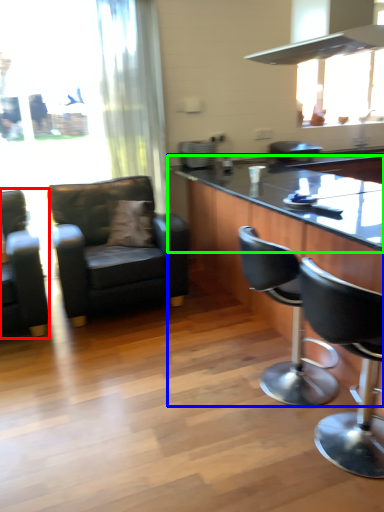
Question: Which is nearer to the chair (highlighted by a red box)? table (highlighted by a blue box) or countertop (highlighted by a green box).

Choices:
 (A) table
 (B) countertop

Answer: (A)